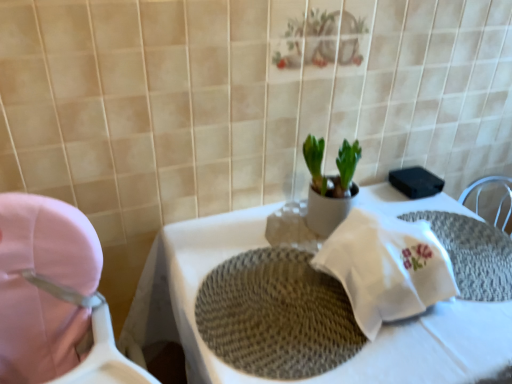
In order to face white woven placemat at center, should I rotate leftwards or rightwards?

A 12.351 degree turn to the right will do.

Image resolution: width=512 pixels, height=384 pixels. I want to click on white woven placemat at center, so click(191, 286).

Is pink fabric baby carriage at left inside white woven placemat at center?

No, pink fabric baby carriage at left is not surrounded by white woven placemat at center.

Can you confirm if white woven placemat at center is shorter than pink fabric baby carriage at left?

Correct, white woven placemat at center is not as tall as pink fabric baby carriage at left.

Is pink fabric baby carriage at left at the back of white woven placemat at center?

No.

Considering the relative sizes of woven beige placemat at center and white woven placemat at center in the image provided, is woven beige placemat at center wider than white woven placemat at center?

Indeed, woven beige placemat at center has a greater width compared to white woven placemat at center.

Considering the positions of objects woven beige placemat at center and white woven placemat at center in the image provided, who is more to the left, woven beige placemat at center or white woven placemat at center?

Positioned to the left is woven beige placemat at center.

Can you confirm if woven beige placemat at center is taller than white woven placemat at center?

No, woven beige placemat at center is not taller than white woven placemat at center.

Which is in front, point (210, 340) or point (394, 240)?

The point (210, 340) is in front.

How different are the orientations of white woven placemat at center and white woven placemat at center in degrees?

The angle between the facing direction of white woven placemat at center and the facing direction of white woven placemat at center is 0.92 degrees.

Considering the positions of objects white woven placemat at center and white woven placemat at center in the image provided, who is in front, white woven placemat at center or white woven placemat at center?

white woven placemat at center is closer to the camera.

Which is more to the right, white woven placemat at center or white woven placemat at center?

white woven placemat at center is more to the right.

Is white woven placemat at center positioned with its back to white woven placemat at center?

No, white woven placemat at center's orientation is not away from white woven placemat at center.

In the scene shown: Is pink fabric baby carriage at left not within woven beige placemat at center?

pink fabric baby carriage at left is positioned outside woven beige placemat at center.

Which of these two, pink fabric baby carriage at left or woven beige placemat at center, is wider?

pink fabric baby carriage at left is wider.

Based on the photo, does pink fabric baby carriage at left turn towards woven beige placemat at center?

No, pink fabric baby carriage at left is not aimed at woven beige placemat at center.

Which of these two, pink fabric baby carriage at left or woven beige placemat at center, is smaller?

woven beige placemat at center.

Which is closer to the camera, (373, 207) or (362, 260)?

Point (373, 207) is farther from the camera than point (362, 260).

Locate an element on the screen. material behind the white woven placemat at center is located at coordinates (386, 267).

Is the depth of white woven placemat at center greater than that of white woven placemat at center?

No, the depth of white woven placemat at center is less than that of white woven placemat at center.

Between white woven placemat at center and white woven placemat at center, which one has larger size?

Bigger between the two is white woven placemat at center.

From a real-world perspective, between pink fabric baby carriage at left and white woven placemat at center, who is vertically lower?

white woven placemat at center, from a real-world perspective.

How much distance is there between pink fabric baby carriage at left and white woven placemat at center?

They are 12.88 inches apart.

Between point (73, 357) and point (408, 373), which one is positioned in front?

The point (408, 373) is closer.

Considering the positions of objects pink fabric baby carriage at left and white woven placemat at center in the image provided, who is in front, pink fabric baby carriage at left or white woven placemat at center?

pink fabric baby carriage at left is more forward.

Can you tell me how much woven beige placemat at center and white woven placemat at center differ in facing direction?

1.1 degrees separate the facing orientations of woven beige placemat at center and white woven placemat at center.

Relative to white woven placemat at center, is woven beige placemat at center in front or behind?

Clearly, woven beige placemat at center is behind white woven placemat at center.

Considering the positions of point (238, 303) and point (478, 314), is point (238, 303) closer or farther from the camera than point (478, 314)?

Point (238, 303) is positioned farther from the camera compared to point (478, 314).

Would you say woven beige placemat at center is outside white woven placemat at center?

Actually, woven beige placemat at center is within white woven placemat at center.

The height and width of the screenshot is (384, 512). Find the location of `baby carriage beneath the white woven placemat at center (from a real-world perspective)`. baby carriage beneath the white woven placemat at center (from a real-world perspective) is located at coordinates (53, 298).

Locate an element on the screen. material above the woven beige placemat at center (from the image's perspective) is located at coordinates pyautogui.click(x=386, y=267).

Considering their positions, is woven beige placemat at center positioned further to white woven placemat at center than pink fabric baby carriage at left?

Among the two, pink fabric baby carriage at left is located further to white woven placemat at center.

Looking at the image, which one is located closer to white woven placemat at center, pink fabric baby carriage at left or woven beige placemat at center?

woven beige placemat at center is closer to white woven placemat at center.

Estimate the real-world distances between objects in this image. Which object is closer to white woven placemat at center, white woven placemat at center or woven beige placemat at center?

woven beige placemat at center is positioned closer to the anchor white woven placemat at center.

Which object lies further to the anchor point woven beige placemat at center, white woven placemat at center or pink fabric baby carriage at left?

pink fabric baby carriage at left.

In the scene shown: From the image, which object appears to be nearer to pink fabric baby carriage at left, woven beige placemat at center or white woven placemat at center?

woven beige placemat at center is closer to pink fabric baby carriage at left.

Consider the image. Looking at the image, which one is located further to white woven placemat at center, pink fabric baby carriage at left or white woven placemat at center?

pink fabric baby carriage at left.

From the image, which object appears to be nearer to woven beige placemat at center, pink fabric baby carriage at left or white woven placemat at center?

white woven placemat at center is positioned closer to the anchor woven beige placemat at center.

Considering their positions, is pink fabric baby carriage at left positioned further to white woven placemat at center than white woven placemat at center?

pink fabric baby carriage at left is positioned further to the anchor white woven placemat at center.

Find the location of a particular element. place mat between white woven placemat at center and white woven placemat at center from top to bottom is located at coordinates coord(276,315).

This screenshot has height=384, width=512. In order to click on place mat between pink fabric baby carriage at left and white woven placemat at center from left to right in this screenshot , I will do `click(276, 315)`.

Where is `table between pink fabric baby carriage at left and white woven placemat at center from left to right`? table between pink fabric baby carriage at left and white woven placemat at center from left to right is located at coordinates point(191,286).

The height and width of the screenshot is (384, 512). In order to click on place mat located between pink fabric baby carriage at left and white woven placemat at center in the left-right direction in this screenshot , I will do `click(276, 315)`.